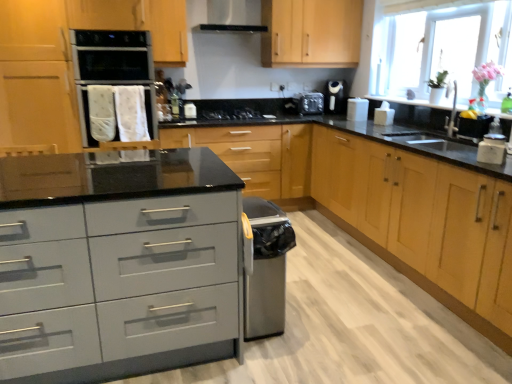
Question: Is there a large distance between white glossy toaster at upper right, which is counted as the second appliance, starting from the front, and black plastic toaster at upper center, the 1th appliance in the back-to-front sequence?

Choices:
 (A) no
 (B) yes

Answer: (A)

Question: Is white glossy toaster at upper right, acting as the second appliance starting from the right, in front of black plastic toaster at upper center, which is counted as the third appliance, starting from the front?

Choices:
 (A) yes
 (B) no

Answer: (A)

Question: Considering the relative positions of white glossy toaster at upper right, marked as the 2th appliance in a left-to-right arrangement, and black plastic toaster at upper center, the 1th appliance in the back-to-front sequence, in the image provided, is white glossy toaster at upper right, marked as the 2th appliance in a left-to-right arrangement, to the right of black plastic toaster at upper center, the 1th appliance in the back-to-front sequence, from the viewer's perspective?

Choices:
 (A) no
 (B) yes

Answer: (B)

Question: Does white glossy toaster at upper right, acting as the second appliance starting from the right, have a greater width compared to black plastic toaster at upper center, the 1th appliance in the back-to-front sequence?

Choices:
 (A) no
 (B) yes

Answer: (A)

Question: Can you confirm if white glossy toaster at upper right, which is counted as the second appliance, starting from the front, is positioned to the left of black plastic toaster at upper center, which is counted as the third appliance, starting from the front?

Choices:
 (A) yes
 (B) no

Answer: (B)

Question: Is white glossy toaster at upper right, positioned as the second appliance in back-to-front order, to the left or to the right of black matte gas stove at center in the image?

Choices:
 (A) right
 (B) left

Answer: (A)

Question: Considering the positions of white glossy toaster at upper right, marked as the 2th appliance in a left-to-right arrangement, and black matte gas stove at center in the image, is white glossy toaster at upper right, marked as the 2th appliance in a left-to-right arrangement, bigger or smaller than black matte gas stove at center?

Choices:
 (A) small
 (B) big

Answer: (A)

Question: From the image's perspective, is white glossy toaster at upper right, acting as the second appliance starting from the right, located above or below black matte gas stove at center?

Choices:
 (A) below
 (B) above

Answer: (B)

Question: From a real-world perspective, is white glossy toaster at upper right, which is counted as the second appliance, starting from the front, above or below black matte gas stove at center?

Choices:
 (A) above
 (B) below

Answer: (A)

Question: In the image, is light wood/texture cabinet at right, the 1th cabinetry in the right-to-left sequence, positioned in front of or behind white matte sugar container at right?

Choices:
 (A) front
 (B) behind

Answer: (A)

Question: Choose the correct answer: Is light wood/texture cabinet at right, the 1th cabinetry in the right-to-left sequence, inside white matte sugar container at right or outside it?

Choices:
 (A) outside
 (B) inside

Answer: (A)

Question: Is light wood/texture cabinet at right, the 1th cabinetry in the right-to-left sequence, taller or shorter than white matte sugar container at right?

Choices:
 (A) tall
 (B) short

Answer: (A)

Question: From a real-world perspective, relative to white matte sugar container at right, is light wood/texture cabinet at right, the 1th cabinetry in the right-to-left sequence, vertically above or below?

Choices:
 (A) above
 (B) below

Answer: (B)

Question: Is point (426, 61) positioned closer to the camera than point (229, 114)?

Choices:
 (A) farther
 (B) closer

Answer: (B)

Question: From the image's perspective, is transparent glass window at upper right above or below black matte gas stove at center?

Choices:
 (A) above
 (B) below

Answer: (A)